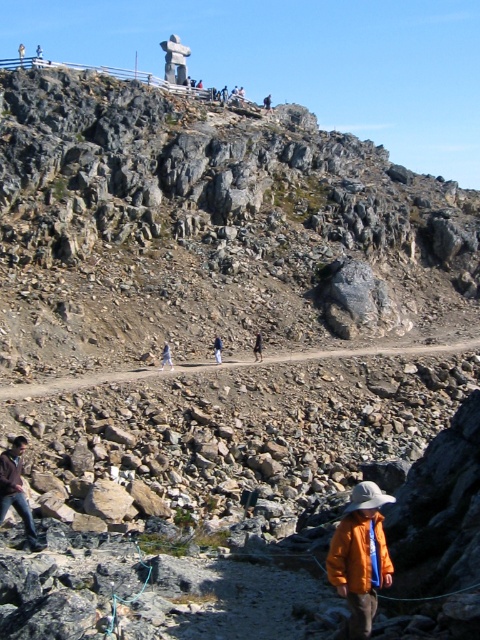
You are a photographer trying to capture a clear shot of the dark blue jeans at center and the light blue denim jacket at center. If you want to ensure both are fully visible in your frame, which object should you focus on first considering their widths?

The dark blue jeans at center might be wider than light blue denim jacket at center, so you should focus on the dark blue jeans at center first to ensure it fits within the frame.

You are a hiker trying to identify clothing items in the scene. Which of the two items, the blue fabric pants at center or the light blue denim jacket at center, is taller?

The blue fabric pants at center is much taller than the light blue denim jacket at center.